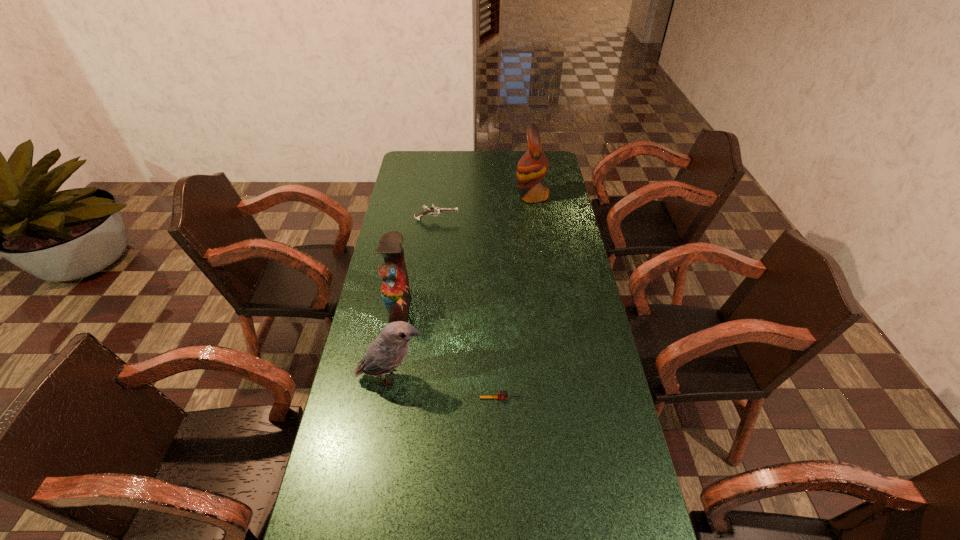
This screenshot has height=540, width=960. Find the location of `blank space at the far left corner`. blank space at the far left corner is located at coordinates (413, 158).

Locate an element on the screen. The height and width of the screenshot is (540, 960). vacant space in between the nearest parrot and the rightmost parrot is located at coordinates (462, 287).

Where is `unoccupied position between the rightmost object and the nearest object`? unoccupied position between the rightmost object and the nearest object is located at coordinates (516, 297).

This screenshot has width=960, height=540. I want to click on empty space that is in between the second shortest object and the second object from right to left, so click(x=468, y=309).

The image size is (960, 540). Identify the location of empty space that is in between the nearest object and the gun. (468, 309).

This screenshot has height=540, width=960. In order to click on vacant space that's between the fourth nearest object and the fourth farthest object in this screenshot , I will do `click(414, 299)`.

Where is `free spot between the nearest object and the fourth nearest object`? The height and width of the screenshot is (540, 960). free spot between the nearest object and the fourth nearest object is located at coordinates (468, 309).

I want to click on object identified as the second closest to the second farthest object, so click(395, 290).

You are a GUI agent. You are given a task and a screenshot of the screen. Output one action in this format:
    pyautogui.click(x=<x>, y=<y>)
    Task: Click on the object that stands as the fourth closest to the fourth tallest object
    
    Given the screenshot: What is the action you would take?
    pyautogui.click(x=500, y=394)

The image size is (960, 540). What are the coordinates of `the third closest parrot relative to the second shortest object` in the screenshot? It's located at point(389,349).